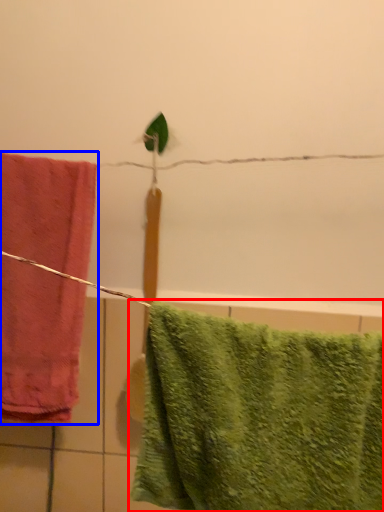
Question: Among these objects, which one is farthest to the camera, towel (highlighted by a red box) or towel (highlighted by a blue box)?

Choices:
 (A) towel
 (B) towel

Answer: (B)